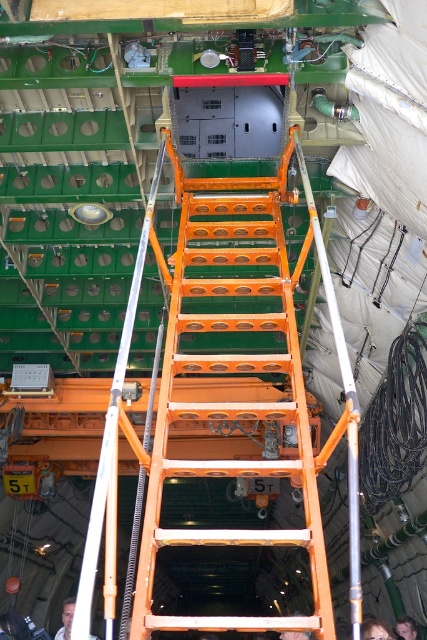
Between orange metallic ladder at center and light skin tone shirt at center, which one has more height?

With more height is light skin tone shirt at center.

Which is above, orange metallic ladder at center or light skin tone shirt at center?

Positioned higher is orange metallic ladder at center.

At what (x,y) coordinates should I click in order to perform the action: click on orange metallic ladder at center. Please return your answer as a coordinate pair (x, y). This screenshot has width=427, height=640. Looking at the image, I should click on (231, 374).

Which is more to the left, orange metallic ladder at center or dark brown leather jacket at lower right?

Positioned to the left is orange metallic ladder at center.

Can you confirm if orange metallic ladder at center is positioned to the left of dark brown leather jacket at lower right?

Correct, you'll find orange metallic ladder at center to the left of dark brown leather jacket at lower right.

Between point (172, 300) and point (400, 636), which one is positioned in front?

Point (172, 300)

I want to click on orange metallic ladder at center, so click(231, 374).

In the scene shown: Which is below, orange metallic ladder at center or smooth skin man at lower center?

smooth skin man at lower center

Between point (277, 246) and point (309, 634), which one is positioned behind?

The point (277, 246) is more distant.

Which is in front, point (129, 634) or point (309, 632)?

Point (129, 634) is in front.

Locate an element on the screen. This screenshot has width=427, height=640. orange metallic ladder at center is located at coordinates (231, 374).